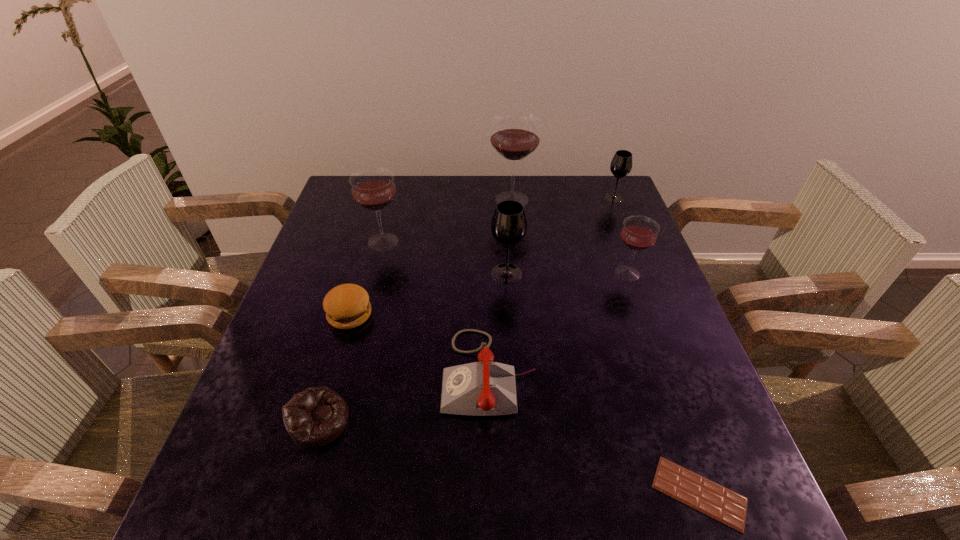
Select which wineglass appears as the second closest to the nearest object. Please provide its 2D coordinates. Your answer should be formatted as a tuple, i.e. [(x, y)], where the tuple contains the x and y coordinates of a point satisfying the conditions above.

[(509, 225)]

Identify which wineglass is located as the fourth nearest to the second biggest red wineglass. Please provide its 2D coordinates. Your answer should be formatted as a tuple, i.e. [(x, y)], where the tuple contains the x and y coordinates of a point satisfying the conditions above.

[(621, 164)]

I want to click on red wineglass identified as the second closest to the telephone, so click(372, 188).

Select which red wineglass is the second closest to the chocolate bar. Please provide its 2D coordinates. Your answer should be formatted as a tuple, i.e. [(x, y)], where the tuple contains the x and y coordinates of a point satisfying the conditions above.

[(372, 188)]

The width and height of the screenshot is (960, 540). I want to click on vacant area that satisfies the following two spatial constraints: 1. on the back side of the second shortest object; 2. on the right side of the rightmost red wineglass, so click(x=362, y=273).

You are a GUI agent. You are given a task and a screenshot of the screen. Output one action in this format:
    pyautogui.click(x=<x>, y=<y>)
    Task: Click on the free location that satisfies the following two spatial constraints: 1. on the back side of the third farthest object; 2. on the right side of the brown hamburger
    The width and height of the screenshot is (960, 540).
    Given the screenshot: What is the action you would take?
    pyautogui.click(x=371, y=241)

The height and width of the screenshot is (540, 960). What are the coordinates of `vacant space that satisfies the following two spatial constraints: 1. on the back side of the hamburger; 2. on the left side of the rightmost red wineglass` in the screenshot? It's located at (362, 273).